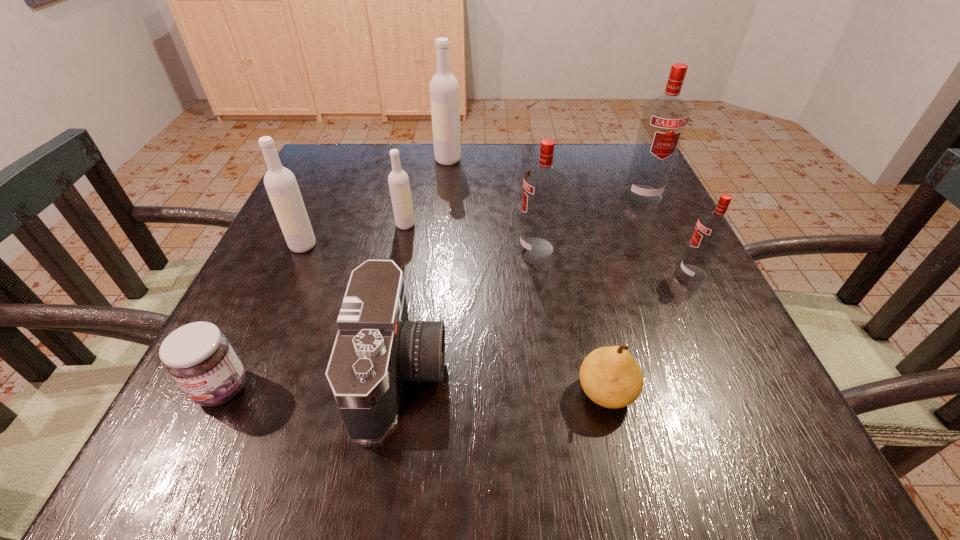
At what (x,y) coordinates should I click in order to perform the action: click on free point between the leftmost vodka and the second nearest red vodka. Please return your answer as a coordinate pair (x, y). The image size is (960, 540). Looking at the image, I should click on (420, 247).

The height and width of the screenshot is (540, 960). Identify the location of blank region between the pear and the nearest white vodka. (454, 319).

Locate an element on the screen. Image resolution: width=960 pixels, height=540 pixels. unoccupied area between the second farthest red vodka and the pear is located at coordinates (571, 320).

At what (x,y) coordinates should I click in order to perform the action: click on free area in between the pear and the biggest red vodka. Please return your answer as a coordinate pair (x, y). Looking at the image, I should click on (624, 294).

Where is `free space that is in between the farthest object and the camera`? The height and width of the screenshot is (540, 960). free space that is in between the farthest object and the camera is located at coordinates (x=424, y=266).

This screenshot has width=960, height=540. What are the coordinates of `empty space between the farthest white vodka and the second smallest white vodka` in the screenshot? It's located at (375, 202).

The height and width of the screenshot is (540, 960). I want to click on unoccupied position between the pear and the nearest red vodka, so click(x=649, y=333).

Locate which object ranks eighth in proximity to the eighth nearest object. Please provide its 2D coordinates. Your answer should be formatted as a tuple, i.e. [(x, y)], where the tuple contains the x and y coordinates of a point satisfying the conditions above.

[(199, 357)]

Image resolution: width=960 pixels, height=540 pixels. I want to click on object that is the seventh nearest to the fourth nearest vodka, so click(x=664, y=119).

The width and height of the screenshot is (960, 540). I want to click on the third closest vodka to the camera, so click(398, 180).